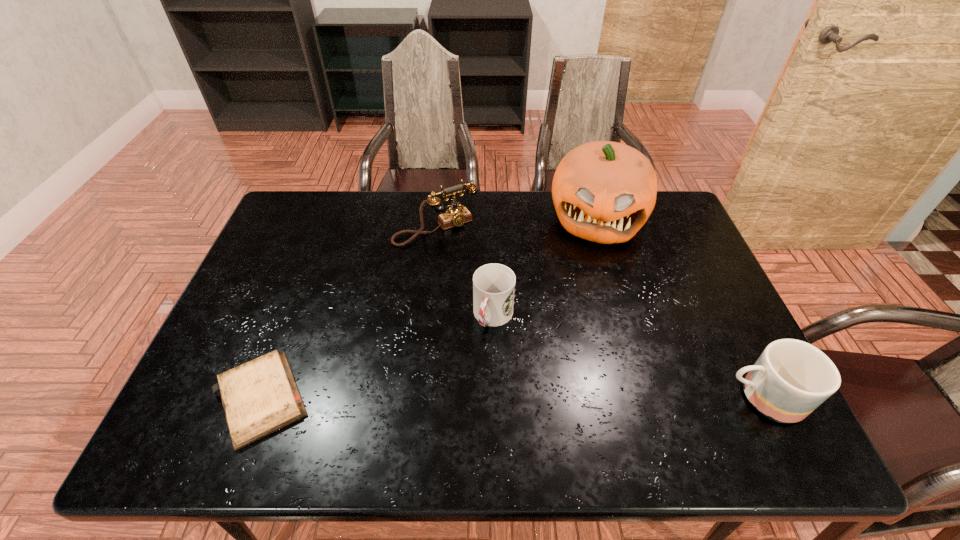
In order to click on vacant spot on the desktop that is between the diary and the mug and is positioned on the front-facing side of the telephone in this screenshot , I will do `click(557, 398)`.

I want to click on free space on the desktop that is between the leftmost object and the mug and is positioned on the handle side of the cup, so click(x=458, y=398).

This screenshot has height=540, width=960. What are the coordinates of `free space on the desktop that is between the shortest object and the mug and is positioned on the face of the tallest object` in the screenshot? It's located at (579, 397).